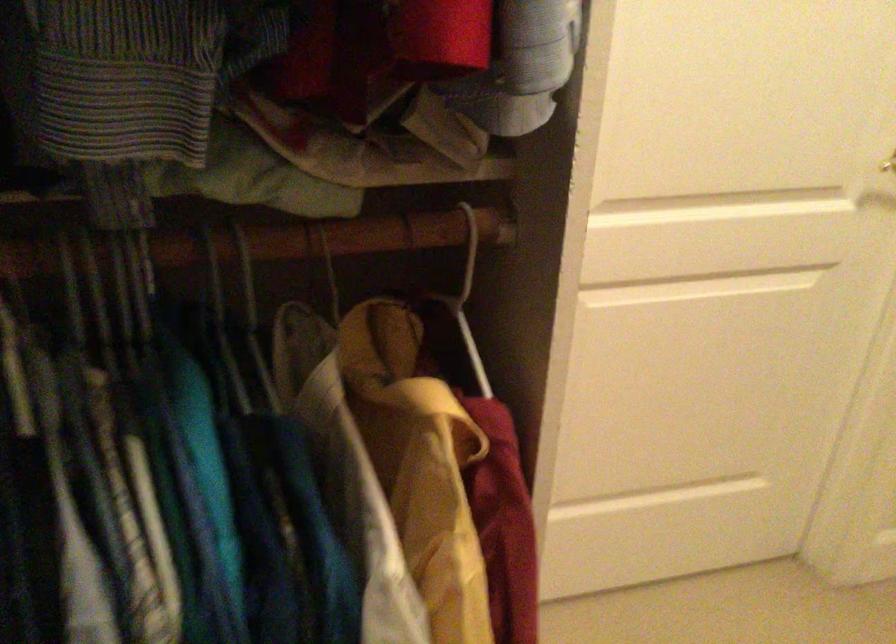
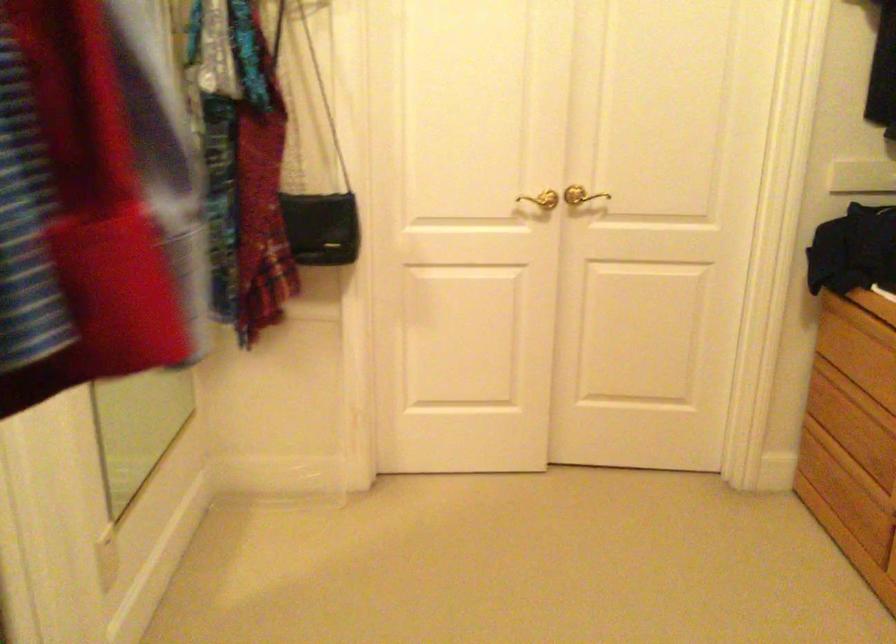
Question: How did the camera likely rotate?

Choices:
 (A) Left
 (B) Right
 (C) Up
 (D) Down

Answer: (B)